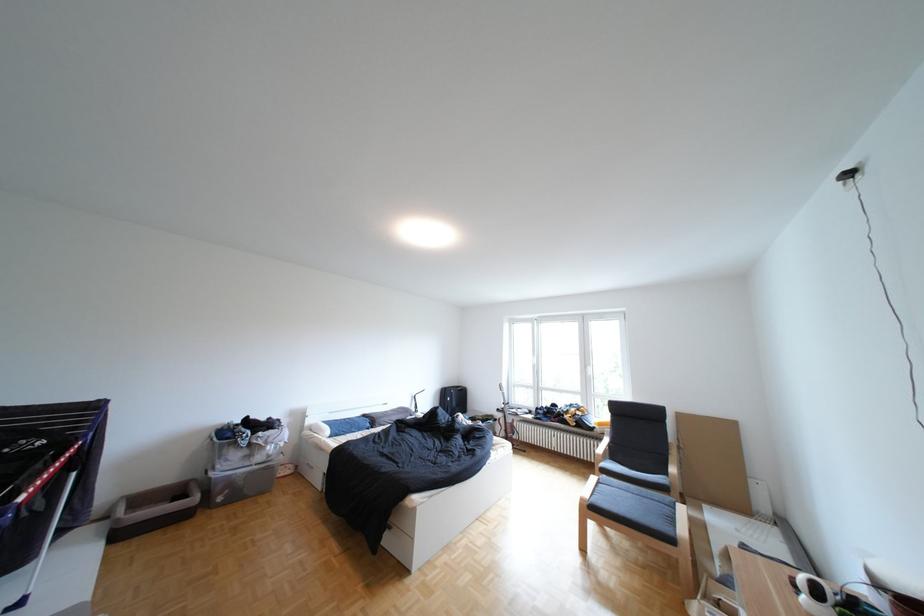
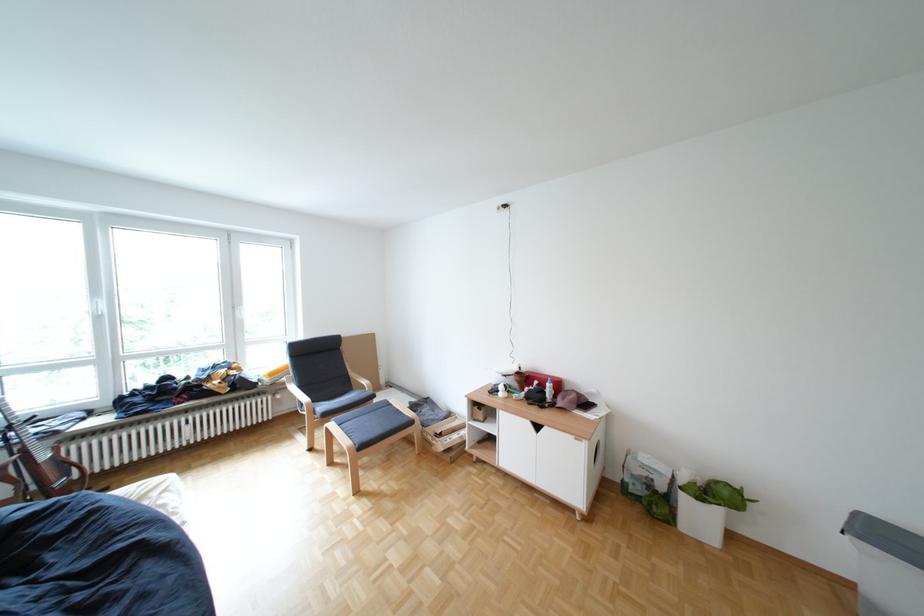
The point at (550, 367) is marked in the first image. Where is the corresponding point in the second image?

(114, 318)